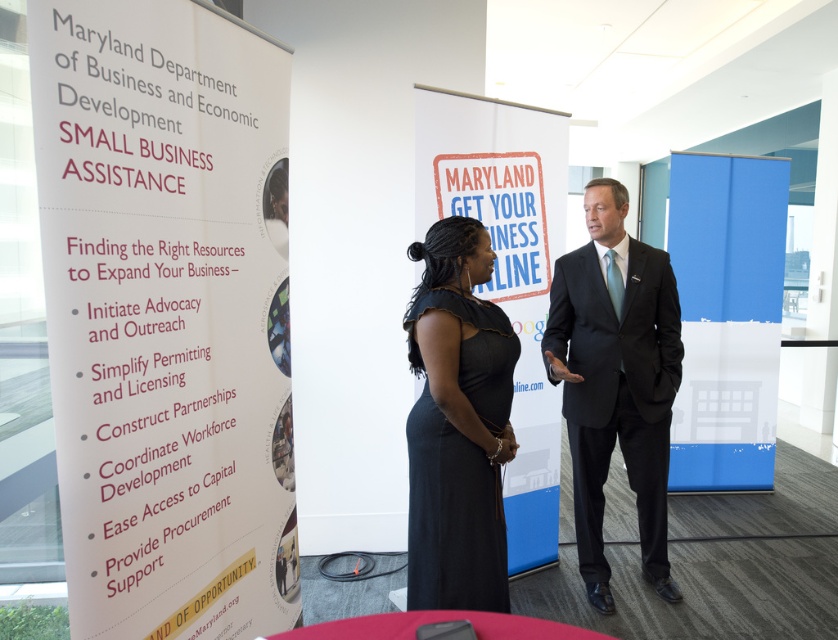
Question: Considering the relative positions of black suit at center and white paper at center in the image provided, where is black suit at center located with respect to white paper at center?

Choices:
 (A) right
 (B) left

Answer: (A)

Question: Is black suit at center bigger than white paper at center?

Choices:
 (A) yes
 (B) no

Answer: (A)

Question: Which of the following is the farthest from the observer?

Choices:
 (A) (454, 467)
 (B) (583, 444)

Answer: (B)

Question: Estimate the real-world distances between objects in this image. Which object is closer to the white paper at center?

Choices:
 (A) black satin dress at center
 (B) black suit at center

Answer: (B)

Question: Does white paper at left have a greater width compared to white paper at center?

Choices:
 (A) yes
 (B) no

Answer: (B)

Question: Estimate the real-world distances between objects in this image. Which object is farther from the white paper at left?

Choices:
 (A) black satin dress at center
 (B) white paper at center
 (C) black suit at center

Answer: (C)